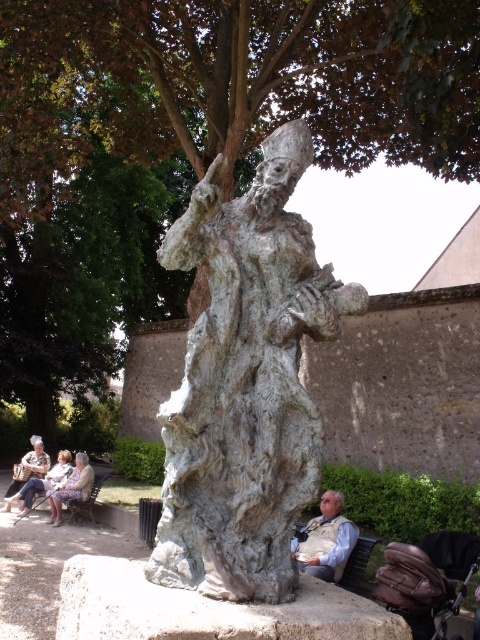
In the scene shown: Between bronze statue at center and white textured fabric at lower left, which one is positioned higher?

bronze statue at center

Does bronze statue at center have a lesser height compared to white textured fabric at lower left?

No.

Between point (256, 253) and point (75, 499), which one is positioned behind?

The point (75, 499) is more distant.

Locate an element on the screen. The height and width of the screenshot is (640, 480). bronze statue at center is located at coordinates (245, 384).

Is bronze statue at center to the left of light brown leather vest at lower center from the viewer's perspective?

Indeed, bronze statue at center is positioned on the left side of light brown leather vest at lower center.

Does bronze statue at center appear under light brown leather vest at lower center?

Actually, bronze statue at center is above light brown leather vest at lower center.

Locate an element on the screen. This screenshot has width=480, height=640. bronze statue at center is located at coordinates coord(245,384).

Identify the location of bronze statue at center. The width and height of the screenshot is (480, 640). (245, 384).

Consider the image. Is gray stone statue at center to the right of white textured fabric at lower left from the viewer's perspective?

Indeed, gray stone statue at center is positioned on the right side of white textured fabric at lower left.

Describe the element at coordinates (205, 609) in the screenshot. I see `gray stone statue at center` at that location.

Which is in front, point (180, 636) or point (80, 481)?

Point (180, 636) is more forward.

The image size is (480, 640). I want to click on gray stone statue at center, so click(205, 609).